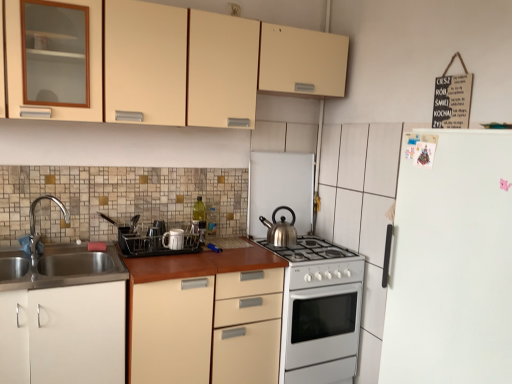
Where is `vacant space in front of matte plastic dish rack at center, which is the 3th appliance in right-to-left order`? This screenshot has height=384, width=512. vacant space in front of matte plastic dish rack at center, which is the 3th appliance in right-to-left order is located at coordinates (146, 258).